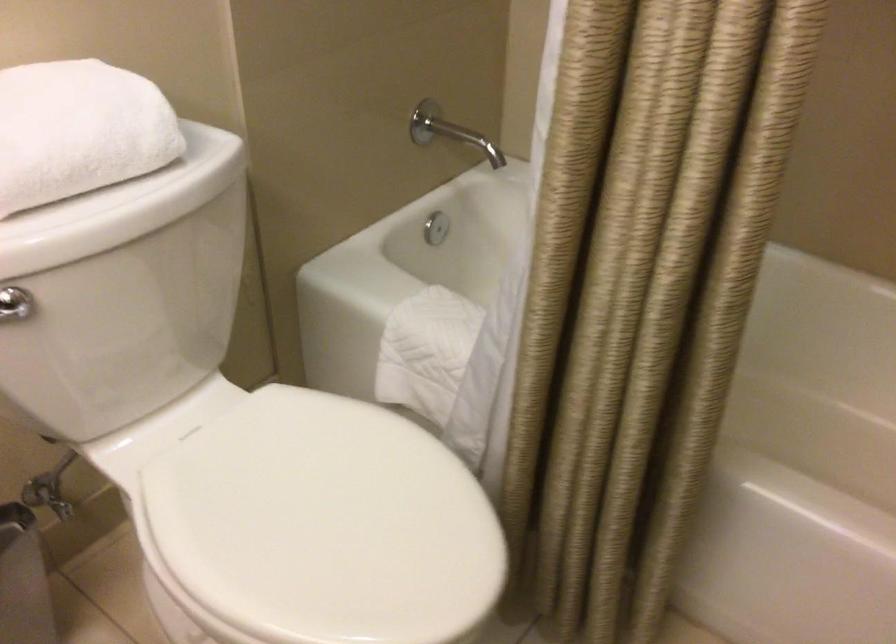
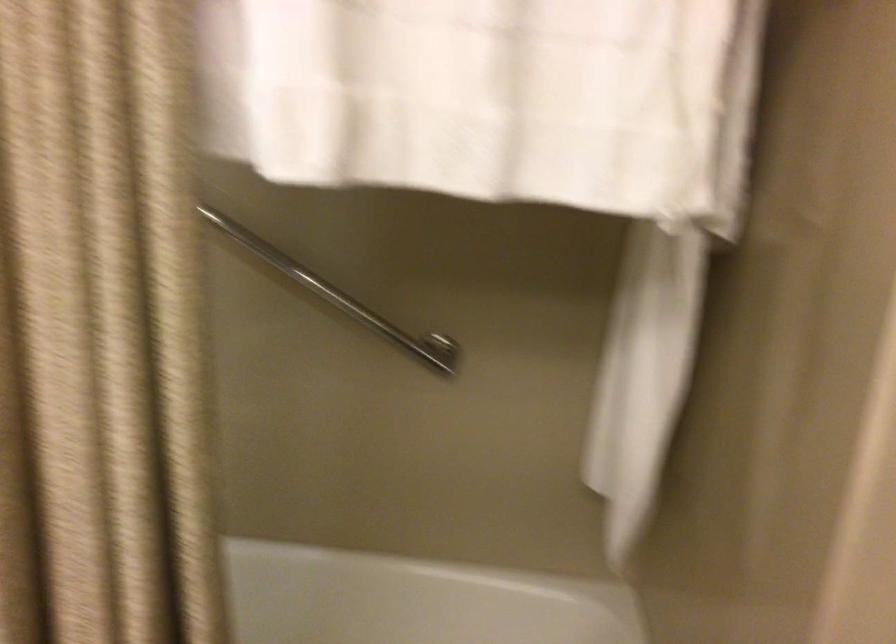
Question: The first image is from the beginning of the video and the second image is from the end. How did the camera likely rotate when shooting the video?

Choices:
 (A) Left
 (B) Right
 (C) Up
 (D) Down

Answer: (B)